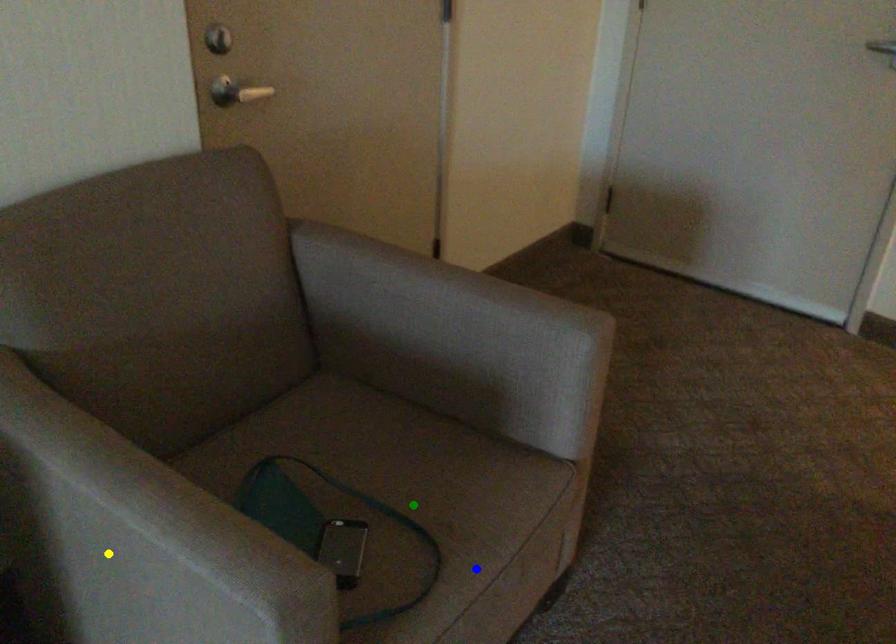
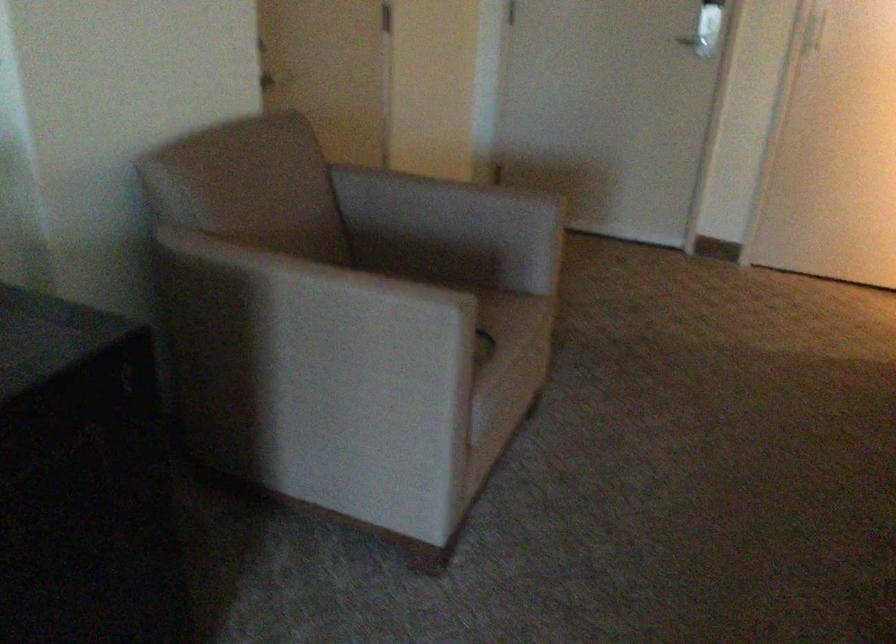
I am providing you with two images of the same scene from different viewpoints. Three points are marked in image1. Which point corresponds to a part or object that is occluded in image2?In image1, three points are marked. Which of them correspond to a part or object that is occluded in image2?Among the three points shown in image1, which one corresponds to a part or object that is no longer visible due to occlusion in image2?

Invisible in image2: green point.